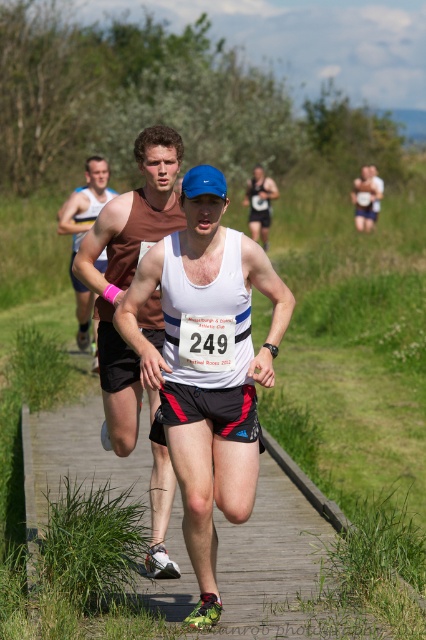
You are a race organizer trying to determine the finishing order of two runners based on their positions at a certain moment during the race. The first runner is at point (x=146, y=368) and the second runner is at point (x=164, y=532). According to the scene description, which runner is closer to the finish line?

Point (x=146, y=368) is in front of point (x=164, y=532), so the runner at point (x=146, y=368) is closer to the finish line.

Consider the image. You are a photographer at the running event. You want to take a photo of both runners. Since the white matte tank top at center and the matte black tank top at center are in the frame, which runner should you focus on to ensure the other is still in the background?

The white matte tank top at center is to the left of matte black tank top at center. Since the white one is in front, you should focus on the white matte tank top at center to keep the matte black tank top at center in the background.

You are a photographer trying to capture the front runner wearing a blue cap and white tank top. You notice two points in the image at coordinates point (117, 448) and point (86, 323). Which point should you focus on to ensure the front runner is in sharp focus?

Point (117, 448) is closer to the camera than point (86, 323), so focusing on point (117, 448) will ensure the front runner is in sharp focus.